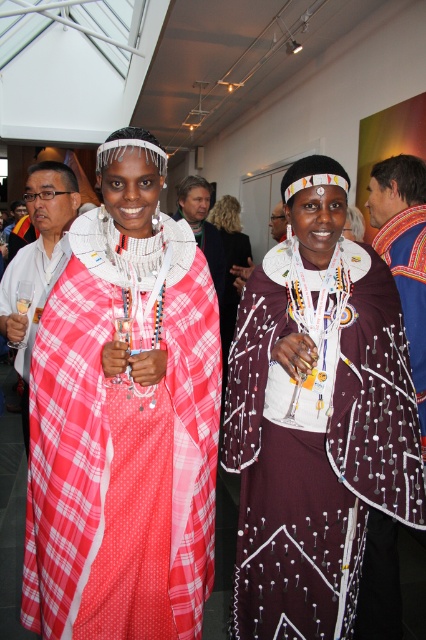
Based on the photo, which of these two, maroon woven fabric at center or matte white shirt at center, stands shorter?

matte white shirt at center is shorter.

Who is higher up, maroon woven fabric at center or matte white shirt at center?

matte white shirt at center is higher up.

This screenshot has height=640, width=426. Describe the element at coordinates (403, 250) in the screenshot. I see `maroon woven fabric at center` at that location.

You are a GUI agent. You are given a task and a screenshot of the screen. Output one action in this format:
    pyautogui.click(x=<x>, y=<y>)
    Task: Click on the maroon woven fabric at center
    
    Given the screenshot: What is the action you would take?
    pyautogui.click(x=403, y=250)

Which is below, maroon fabric dress at center or maroon woven fabric at center?

Positioned lower is maroon fabric dress at center.

Find the location of a particular element. This screenshot has width=426, height=640. maroon fabric dress at center is located at coordinates (316, 417).

Find the location of `maroon fabric dress at center`. maroon fabric dress at center is located at coordinates (x=316, y=417).

Is matte plaid shawl at left smaller than white woven fabric at center?

No, matte plaid shawl at left is not smaller than white woven fabric at center.

Is point (31, 211) more distant than point (195, 221)?

No, it is in front of (195, 221).

Find the location of a particular element. matte plaid shawl at left is located at coordinates (37, 259).